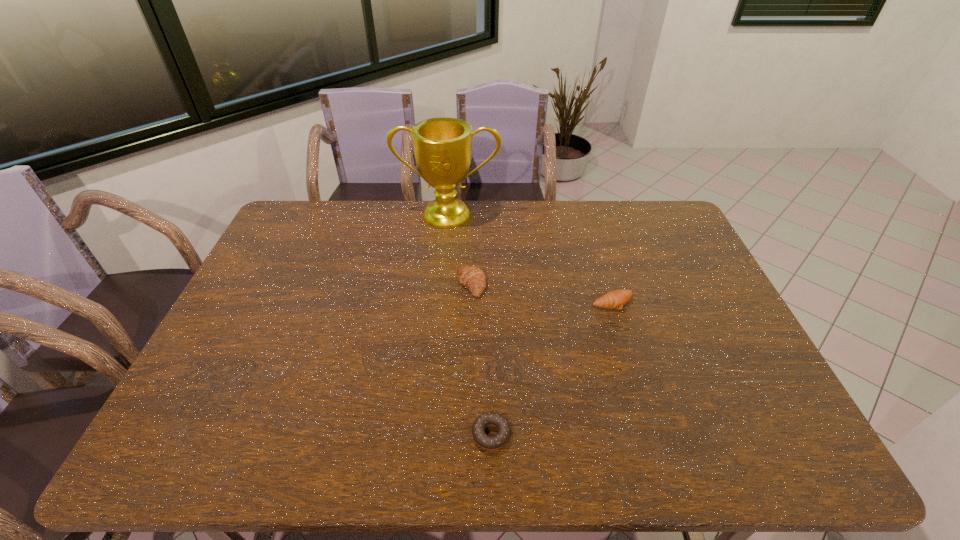
Locate an element on the screen. The image size is (960, 540). object that is the closest to the nearest object is located at coordinates (472, 277).

At what (x,y) coordinates should I click in order to perform the action: click on free location that satisfies the following two spatial constraints: 1. on the shiny surface of the nearest object; 2. on the left side of the tallest object. Please return your answer as a coordinate pair (x, y). Looking at the image, I should click on (428, 434).

Locate an element on the screen. vacant space that satisfies the following two spatial constraints: 1. on the back side of the shortest object; 2. on the left side of the shorter crescent roll is located at coordinates (489, 302).

The image size is (960, 540). Identify the location of vacant area that satisfies the following two spatial constraints: 1. on the shiny surface of the farthest object; 2. on the left side of the shortest object. (428, 434).

I want to click on vacant space that satisfies the following two spatial constraints: 1. on the shiny surface of the tallest object; 2. on the left side of the taller crescent roll, so click(x=442, y=285).

You are a GUI agent. You are given a task and a screenshot of the screen. Output one action in this format:
    pyautogui.click(x=<x>, y=<y>)
    Task: Click on the vacant region that satisfies the following two spatial constraints: 1. on the shiny surface of the tallest object; 2. on the right side of the shortest object
    The width and height of the screenshot is (960, 540).
    Given the screenshot: What is the action you would take?
    pyautogui.click(x=428, y=434)

I want to click on vacant position in the image that satisfies the following two spatial constraints: 1. on the shiny surface of the second shortest object; 2. on the right side of the award, so click(x=441, y=302).

This screenshot has width=960, height=540. I want to click on vacant position in the image that satisfies the following two spatial constraints: 1. on the shiny surface of the rightmost object; 2. on the left side of the tallest object, so click(441, 302).

What are the coordinates of `vacant region that satisfies the following two spatial constraints: 1. on the back side of the rightmost object; 2. on the right side of the doughnut` in the screenshot? It's located at (489, 302).

Find the location of `free location that satisfies the following two spatial constraints: 1. on the shiny surface of the shortest object; 2. on the left side of the award`. free location that satisfies the following two spatial constraints: 1. on the shiny surface of the shortest object; 2. on the left side of the award is located at coordinates (428, 434).